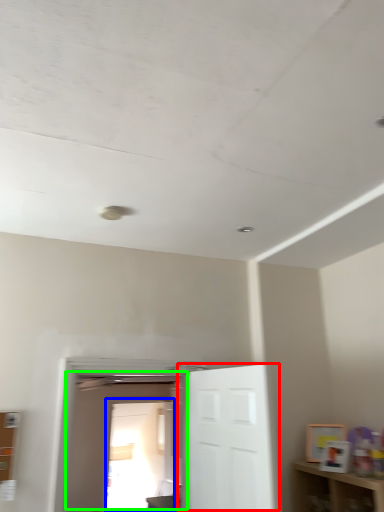
Question: Based on their relative distances, which object is nearer to door (highlighted by a red box)? Choose from glass door (highlighted by a blue box) and door (highlighted by a green box).

Choices:
 (A) glass door
 (B) door

Answer: (B)